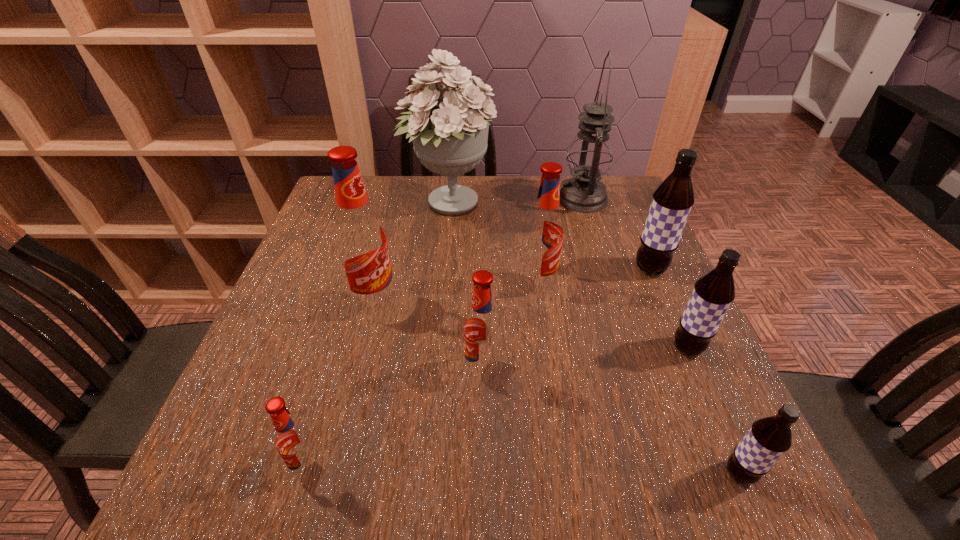
Where is `oil lamp located in the far edge section of the desktop`? oil lamp located in the far edge section of the desktop is located at coordinates (589, 158).

This screenshot has height=540, width=960. Find the location of `bouquet situated at the far edge`. bouquet situated at the far edge is located at coordinates (450, 139).

I want to click on object positioned at the left edge, so click(294, 441).

Where is `oil lamp present at the right edge`? oil lamp present at the right edge is located at coordinates (589, 158).

Image resolution: width=960 pixels, height=540 pixels. What are the coordinates of `object present at the near left corner` in the screenshot? It's located at (294, 441).

Where is `object at the far right corner`? The height and width of the screenshot is (540, 960). object at the far right corner is located at coordinates (589, 158).

Identify the location of object that is at the near right corner. This screenshot has width=960, height=540. (769, 438).

Find the location of a particular element. vacant space at the far edge of the desktop is located at coordinates (415, 200).

The width and height of the screenshot is (960, 540). In order to click on free spot at the left edge of the desktop in this screenshot , I will do `click(246, 372)`.

The height and width of the screenshot is (540, 960). Identify the location of free space at the right edge. (614, 226).